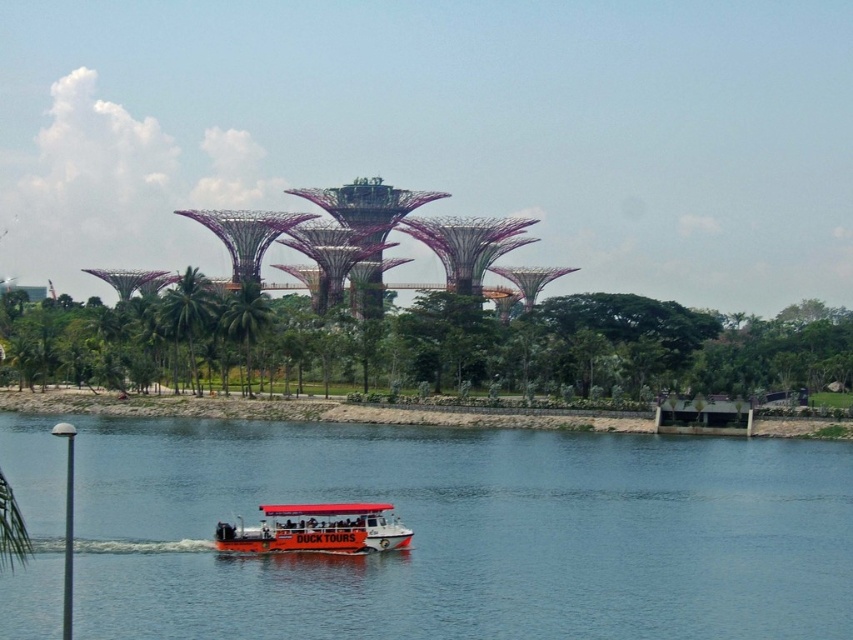
Which of these two, blue water at center or green leafy trees at center, stands shorter?

With less height is blue water at center.

Does blue water at center have a lesser width compared to green leafy trees at center?

Yes.

Which is behind, point (822, 516) or point (334, 324)?

Positioned behind is point (334, 324).

Image resolution: width=853 pixels, height=640 pixels. I want to click on blue water at center, so tap(463, 532).

Which of these two, green leafy trees at center or green leafy tree at center, stands shorter?

green leafy trees at center

Is point (193, 342) closer to viewer compared to point (242, 337)?

No, (193, 342) is behind (242, 337).

Where is `green leafy trees at center`? The image size is (853, 640). green leafy trees at center is located at coordinates (428, 346).

Can you confirm if blue water at center is wider than green leafy tree at center?

Yes.

Does point (682, 618) lie behind point (244, 337)?

No, it is not.

Find the location of a particular element. The height and width of the screenshot is (640, 853). blue water at center is located at coordinates (463, 532).